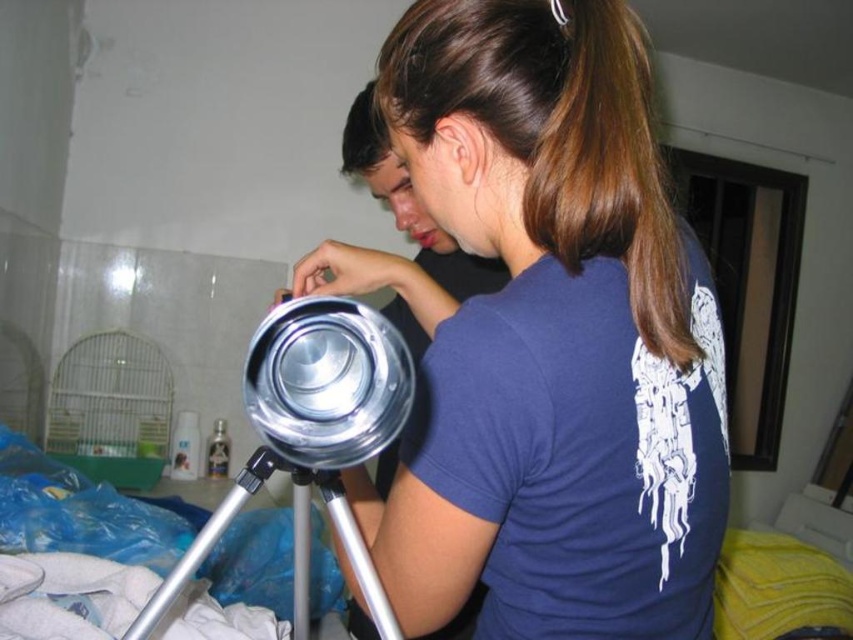
Looking at this image, does shiny metallic tripod at center appear over silver metallic tripod at center?

Correct, shiny metallic tripod at center is located above silver metallic tripod at center.

Which is in front, point (482, 237) or point (299, 509)?

Positioned in front is point (299, 509).

Is point (495, 173) farther from camera compared to point (167, 592)?

Yes, point (495, 173) is farther from viewer.

What are the coordinates of `shiny metallic tripod at center` in the screenshot? It's located at (544, 337).